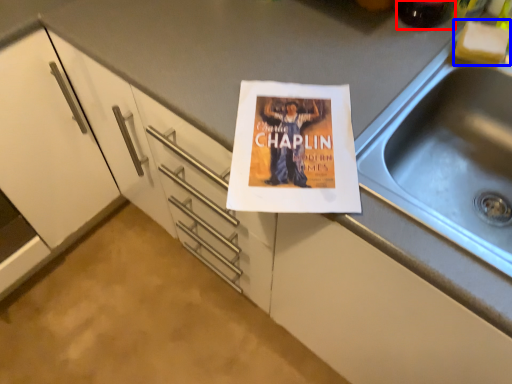
Question: Among these objects, which one is nearest to the camera, beverage (highlighted by a red box) or food (highlighted by a blue box)?

Choices:
 (A) beverage
 (B) food

Answer: (A)